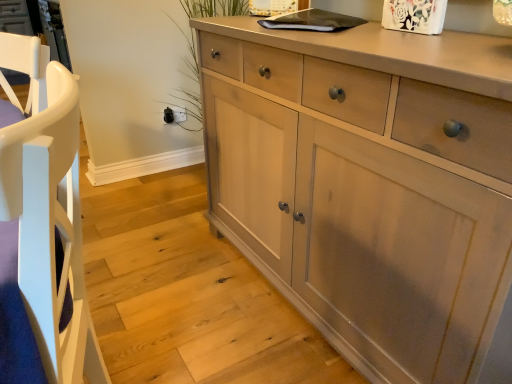
Question: Visually, is white wood armchair at left positioned to the left or to the right of light wood cabinet at center?

Choices:
 (A) right
 (B) left

Answer: (B)

Question: Is white wood armchair at left wider or thinner than light wood cabinet at center?

Choices:
 (A) wide
 (B) thin

Answer: (B)

Question: Estimate the real-world distances between objects in this image. Which object is farther from the white wood armchair at left?

Choices:
 (A) light wood cabinet at center
 (B) matte gray cabinet at lower left

Answer: (B)

Question: Estimate the real-world distances between objects in this image. Which object is closer to the matte gray cabinet at lower left?

Choices:
 (A) white wood armchair at left
 (B) light wood cabinet at center

Answer: (B)